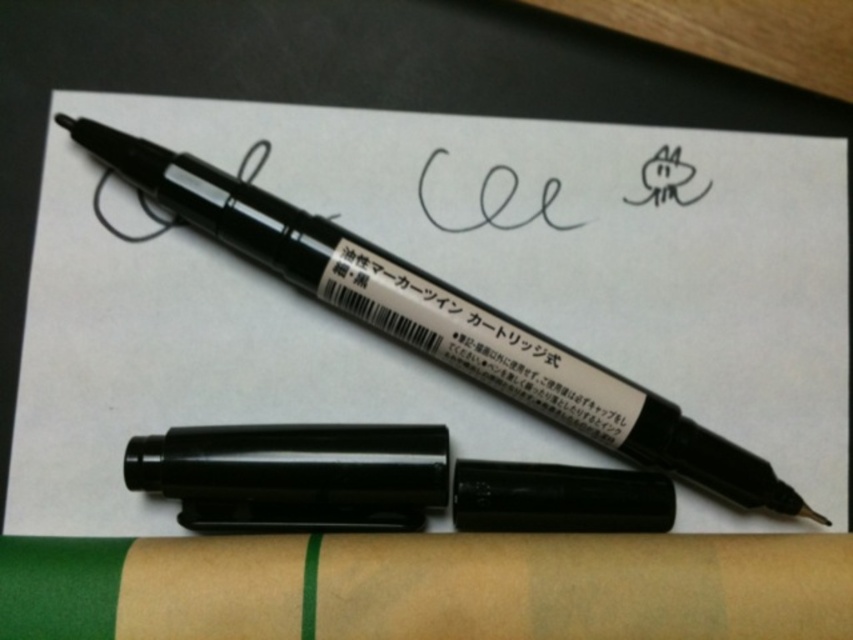
Who is lower down, matte black pen at center or black matte pen at center?

black matte pen at center is lower down.

You are a GUI agent. You are given a task and a screenshot of the screen. Output one action in this format:
    pyautogui.click(x=<x>, y=<y>)
    Task: Click on the matte black pen at center
    The height and width of the screenshot is (640, 853).
    Given the screenshot: What is the action you would take?
    pyautogui.click(x=440, y=321)

This screenshot has height=640, width=853. In order to click on matte black pen at center in this screenshot , I will do `click(440, 321)`.

Does point (468, 339) come farther from viewer compared to point (476, 340)?

No, (468, 339) is in front of (476, 340).

Can you confirm if matte black pen at center is positioned to the right of black matte marker at center?

No, matte black pen at center is not to the right of black matte marker at center.

Does point (192, 189) come farther from viewer compared to point (392, 291)?

That is False.

This screenshot has height=640, width=853. What are the coordinates of `matte black pen at center` in the screenshot? It's located at (440, 321).

Between black matte pen at center and black matte marker at center, which one appears on the left side from the viewer's perspective?

black matte pen at center is more to the left.

Does point (265, 506) come behind point (453, 326)?

No, (265, 506) is in front of (453, 326).

The width and height of the screenshot is (853, 640). I want to click on black matte pen at center, so click(294, 476).